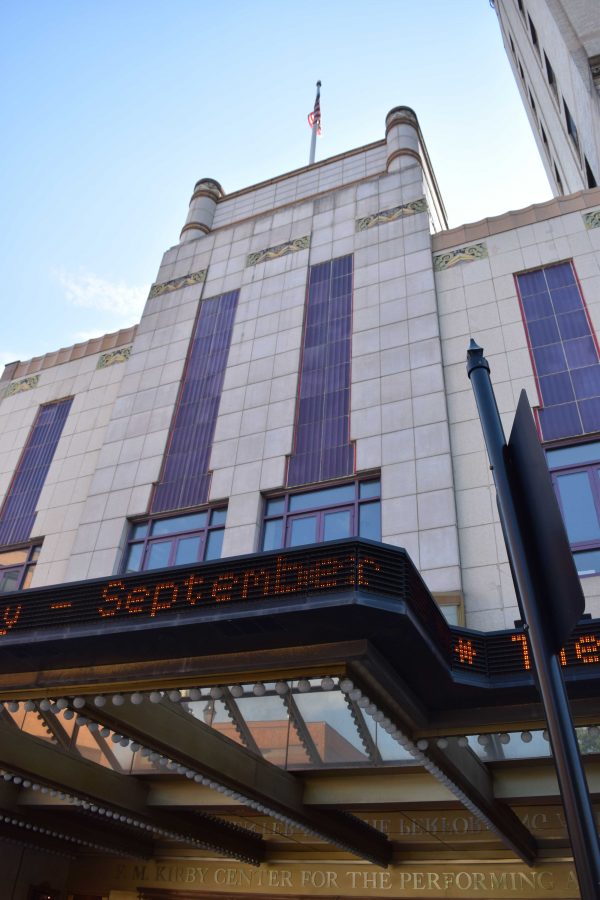
Where is `window`? window is located at coordinates (334, 520).